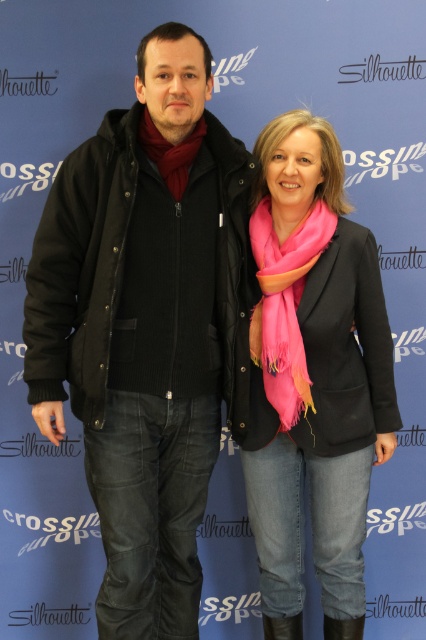
Question: Does black leather boot at lower center appear on the right side of black leather boot at lower right?

Choices:
 (A) no
 (B) yes

Answer: (A)

Question: Considering the relative positions of black cotton jacket at left and black leather boot at lower center in the image provided, where is black cotton jacket at left located with respect to black leather boot at lower center?

Choices:
 (A) below
 (B) above

Answer: (B)

Question: Is pink soft scarf at center to the right of black leather boot at lower center from the viewer's perspective?

Choices:
 (A) no
 (B) yes

Answer: (A)

Question: Which object is the farthest from the black leather boot at lower right?

Choices:
 (A) black cotton jacket at left
 (B) matte red scarf at center
 (C) pink scarf at center

Answer: (B)

Question: Which point is closer to the camera?

Choices:
 (A) black leather boot at lower right
 (B) matte red scarf at center
 (C) black leather boot at lower center
 (D) black cotton jacket at left

Answer: (D)

Question: Which is nearer to the pink scarf at center?

Choices:
 (A) black cotton jacket at left
 (B) black leather boot at lower center

Answer: (A)